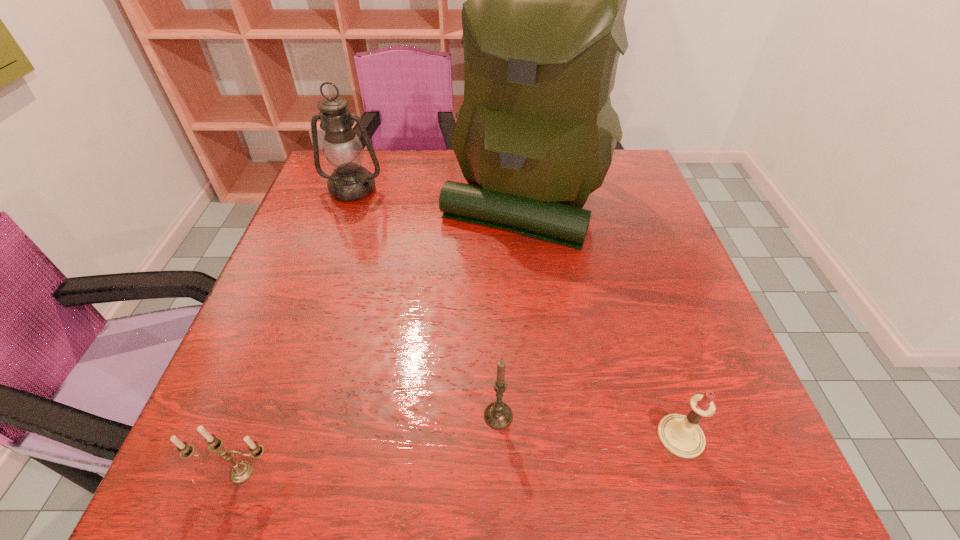
You are a GUI agent. You are given a task and a screenshot of the screen. Output one action in this format:
    pyautogui.click(x=<x>, y=<y>)
    Task: Click on the free spot between the nearest object and the oil lamp
    Image resolution: width=960 pixels, height=540 pixels.
    Given the screenshot: What is the action you would take?
    pyautogui.click(x=298, y=330)

Locate an element on the screen. The image size is (960, 540). empty space that is in between the nearest object and the rightmost candle is located at coordinates (461, 454).

Locate an element on the screen. Image resolution: width=960 pixels, height=540 pixels. free space between the rightmost candle and the backpack is located at coordinates [x=602, y=317].

Image resolution: width=960 pixels, height=540 pixels. I want to click on empty space between the tallest object and the rightmost candle, so click(602, 317).

Locate an element on the screen. The width and height of the screenshot is (960, 540). free space between the fourth shortest object and the backpack is located at coordinates (438, 193).

Identify the location of free spot between the second candle from left to right and the nearest candle. The image size is (960, 540). (370, 444).

Locate an element on the screen. The image size is (960, 540). blank region between the fourth shortest object and the leftmost candle is located at coordinates (298, 330).

At what (x,y) coordinates should I click in order to perform the action: click on the second closest object to the second candle from left to right. Please return your answer as a coordinate pair (x, y). This screenshot has width=960, height=540. Looking at the image, I should click on (241, 471).

This screenshot has width=960, height=540. Identify the location of object that stands as the third closest to the nearest candle. (681, 435).

Where is `candle that is the second nearest to the nearest candle`? The height and width of the screenshot is (540, 960). candle that is the second nearest to the nearest candle is located at coordinates (681, 435).